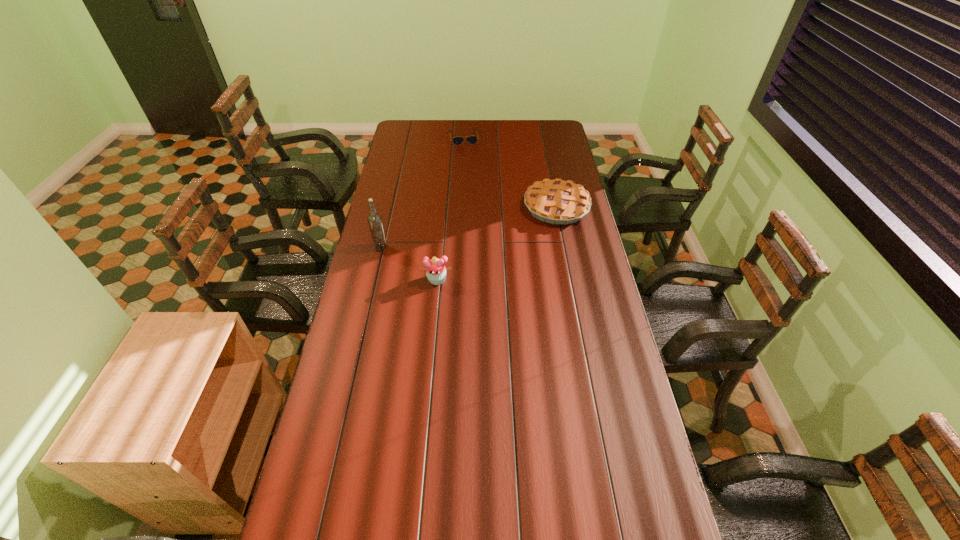
Where is `vacant space on the desktop that is between the cupcake and the rightmost object and is positioned on the label of the third farthest object`? Image resolution: width=960 pixels, height=540 pixels. vacant space on the desktop that is between the cupcake and the rightmost object and is positioned on the label of the third farthest object is located at coordinates (488, 248).

I want to click on free spot on the desktop that is between the cupcake and the second shortest object and is positioned on the front-facing side of the farthest object, so click(487, 249).